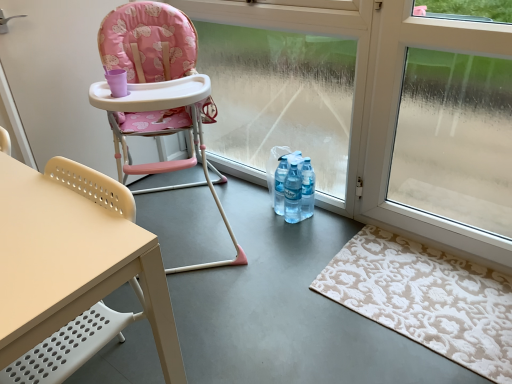
Identify the location of vacant space to the left of transparent glass window at lower right. The image size is (512, 384). coord(357,273).